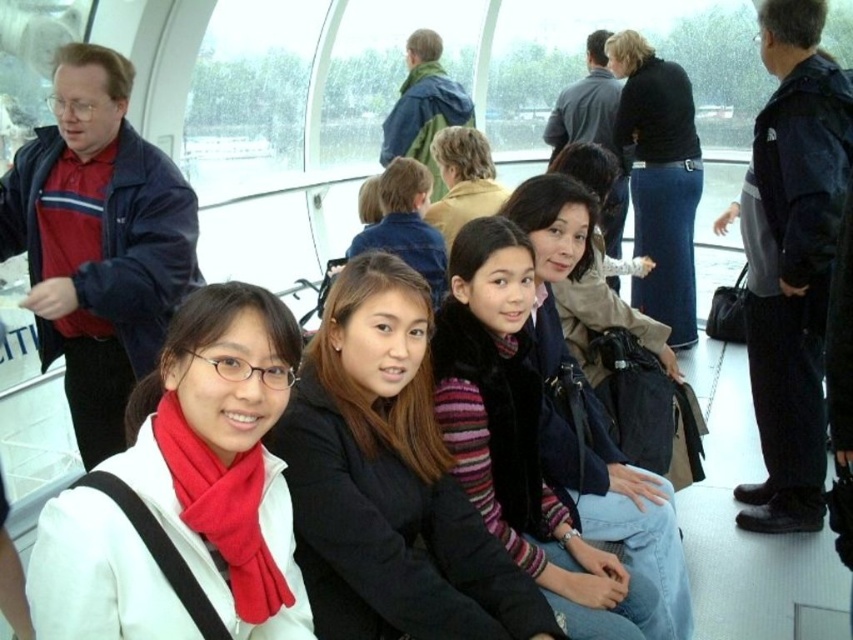
Question: Can you confirm if white matte scarf at lower left is smaller than striped knit sweater at center?

Choices:
 (A) no
 (B) yes

Answer: (B)

Question: Which of these objects is positioned farthest from the black fuzzy vest at center?

Choices:
 (A) black leather jacket at center
 (B) striped knit sweater at center
 (C) light brown hair at center

Answer: (A)

Question: Is white matte scarf at lower left thinner than striped knit sweater at center?

Choices:
 (A) yes
 (B) no

Answer: (A)

Question: From the image, what is the correct spatial relationship of white matte scarf at lower left in relation to light brown hair at center?

Choices:
 (A) above
 (B) below

Answer: (B)

Question: Which point is farther to the camera?

Choices:
 (A) light brown hair at center
 (B) black fuzzy vest at center
 (C) white matte scarf at lower left
 (D) striped knit sweater at center

Answer: (A)

Question: Considering the real-world distances, which object is farthest from the white matte scarf at lower left?

Choices:
 (A) light brown hair at center
 (B) striped knit sweater at center

Answer: (A)